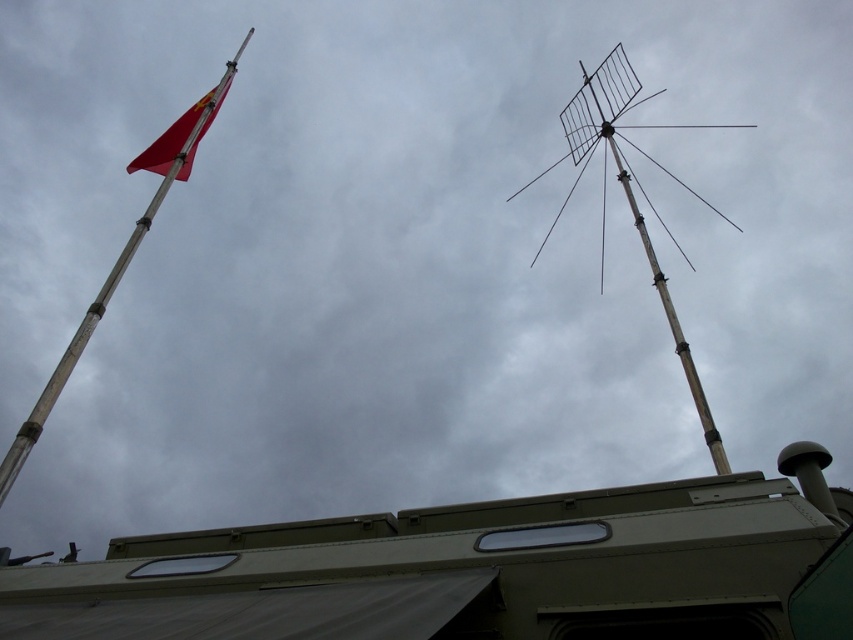
You are standing in front of a vehicle and see the matte green recreational vehicle at lower center and the metallic antenna at upper right. Which object is wider?

The metallic antenna at upper right is wider than the matte green recreational vehicle at lower center.

You are a photographer trying to capture the metallic flag pole at left and the red matte flag at upper left in a single frame. Which object will appear thinner in your photo?

The metallic flag pole at left will appear thinner in the photo since it has a lesser width compared to the red matte flag at upper left.

Based on the photo, you are a photographer taking a picture of the vehicle from below. You notice the metallic flag pole at left and the red matte flag at upper left. Which object is positioned closer to your camera lens?

The metallic flag pole at left is closer to the viewer than the red matte flag at upper left, so the metallic flag pole at left would be closer to the camera lens.